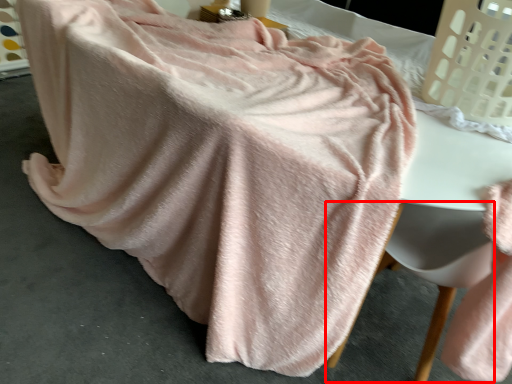
Question: From the image's perspective, where is swivel chair (annotated by the red box) located relative to laundry basket?

Choices:
 (A) above
 (B) below

Answer: (B)